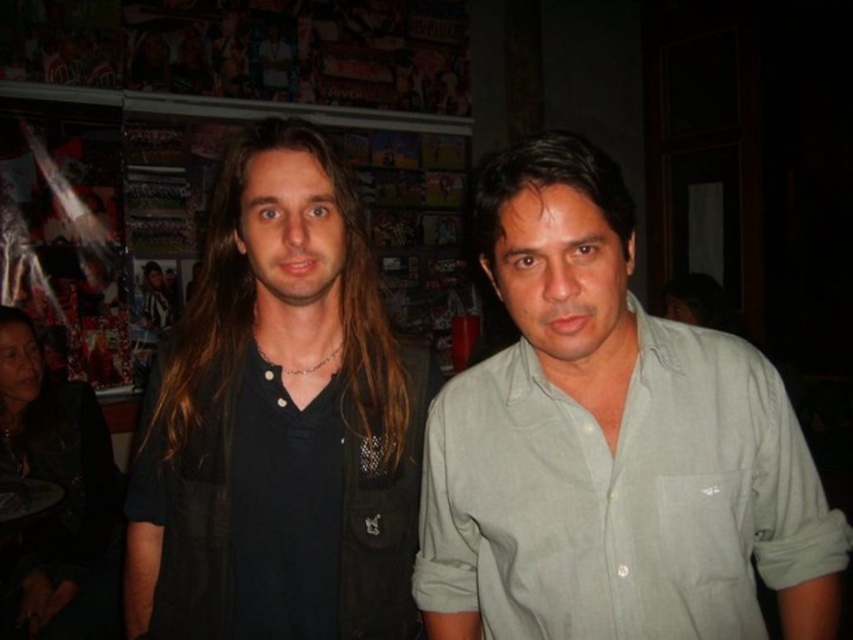
You are holding a camera and want to take a photo of the point at coordinates (514, 586) in the image. If your camera has a minimum focus distance of 30 inches, will you be able to focus on that point?

The distance of point (514, 586) from the camera is 32.72 inches, which is greater than the minimum focus distance of 30 inches. Therefore, you can focus on that point.

You are organizing a clothing donation drive and need to categorize shirts by size. You have a small donation box for medium shirts and a large box for large shirts. You see the light green cotton shirt at center and the black matte shirt at center. Which shirt should go into the large donation box?

The light green cotton shirt at center is bigger than the black matte shirt at center, so the light green cotton shirt at center should go into the large donation box.